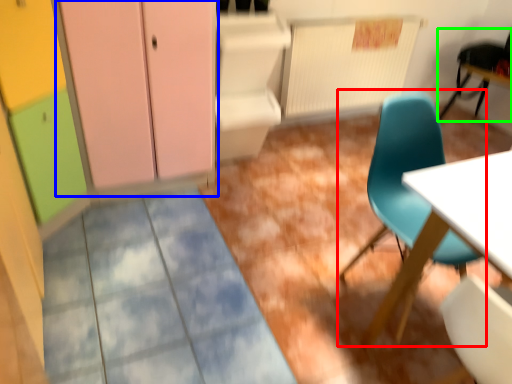
Question: Which is nearer to the chair (highlighted by a red box)? dresser (highlighted by a blue box) or chair (highlighted by a green box).

Choices:
 (A) dresser
 (B) chair

Answer: (A)